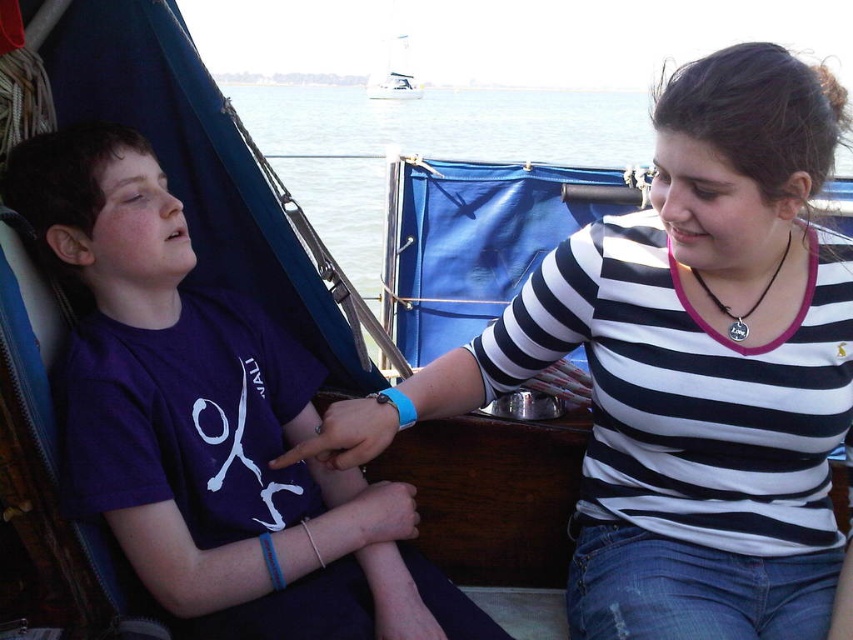
Can you confirm if purple cotton shirt at left is shorter than white sailboat at upper center?

No, purple cotton shirt at left is not shorter than white sailboat at upper center.

Which is behind, point (399, 509) or point (405, 65)?

Point (405, 65)

I want to click on purple cotton shirt at left, so click(210, 426).

Is point (706, 64) more distant than point (161, 193)?

No, (706, 64) is in front of (161, 193).

Does striped cotton shirt at center have a greater width compared to purple cotton shirt at left?

Yes, striped cotton shirt at center is wider than purple cotton shirt at left.

Is point (815, 157) farther from viewer compared to point (213, 460)?

No, (815, 157) is in front of (213, 460).

The width and height of the screenshot is (853, 640). I want to click on striped cotton shirt at center, so click(685, 369).

Between purple cotton shirt at left and clear water at upper center, which one appears on the left side from the viewer's perspective?

Positioned to the left is purple cotton shirt at left.

Describe the element at coordinates (210, 426) in the screenshot. I see `purple cotton shirt at left` at that location.

Find the location of `purple cotton shirt at left`. purple cotton shirt at left is located at coordinates (210, 426).